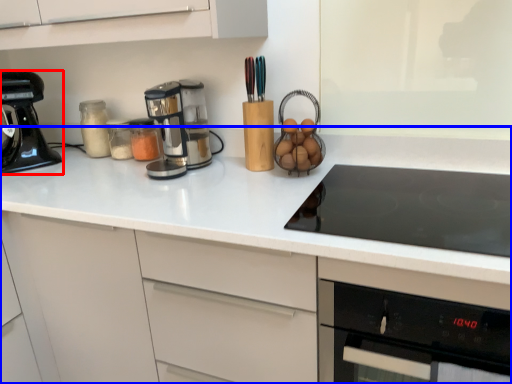
Question: Which of the following is the farthest to the observer, kitchen appliance (highlighted by a red box) or countertop (highlighted by a blue box)?

Choices:
 (A) kitchen appliance
 (B) countertop

Answer: (A)